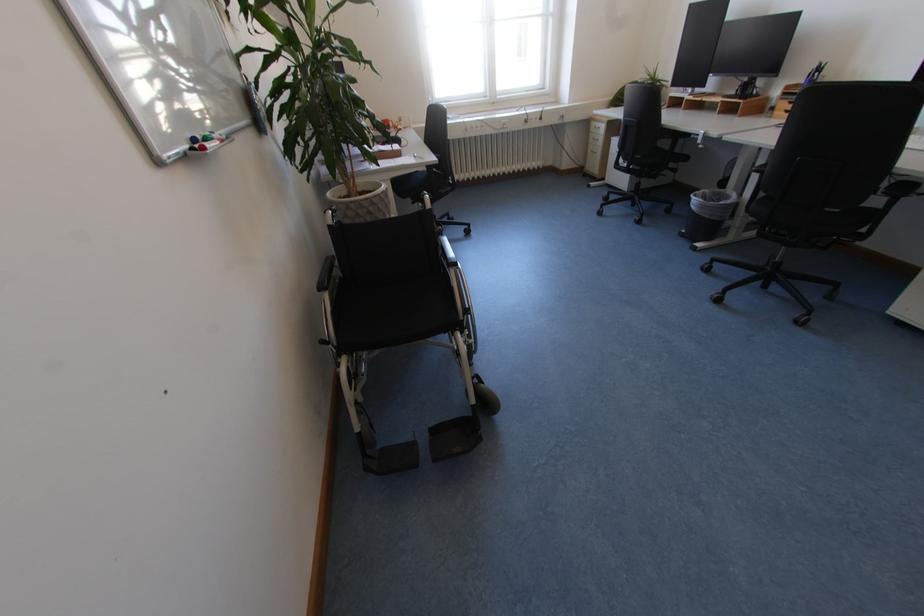
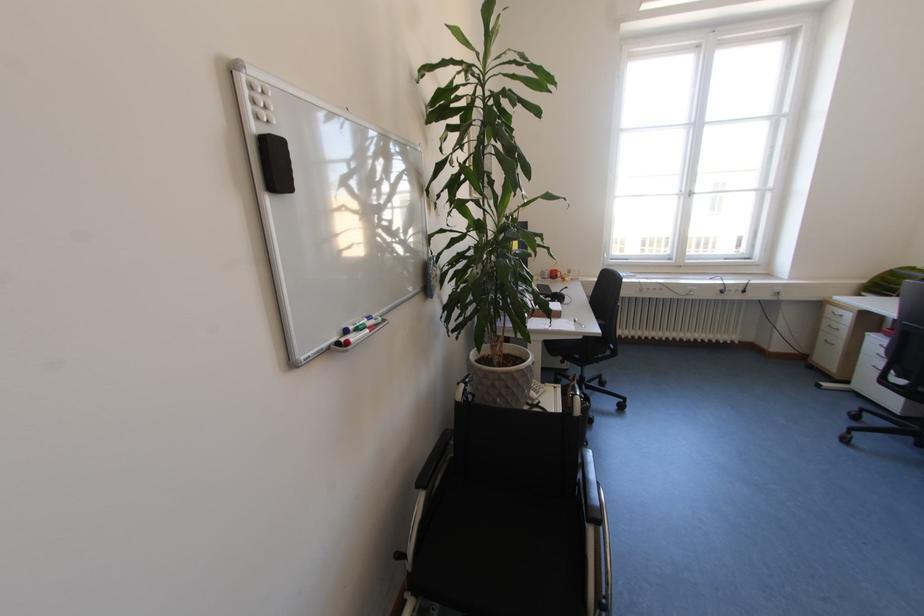
Find the pixel in the second image that matches [599,142] in the first image.

(833, 328)